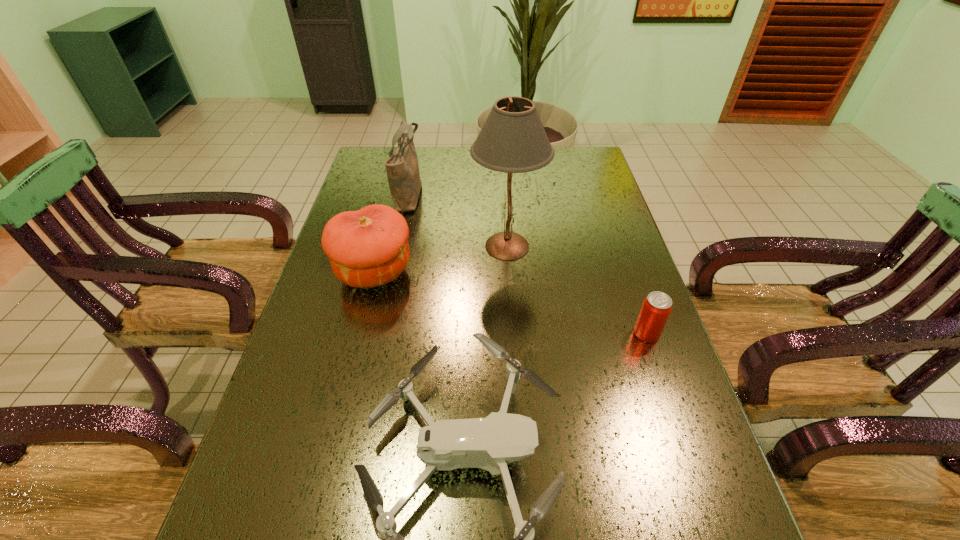
Identify the location of free space between the pumpkin and the tallest object. The image size is (960, 540). (441, 259).

The width and height of the screenshot is (960, 540). I want to click on free space between the can and the farthest object, so click(528, 264).

You are a GUI agent. You are given a task and a screenshot of the screen. Output one action in this format:
    pyautogui.click(x=<x>, y=<y>)
    Task: Click on the free space between the table lamp and the farthest object
    The width and height of the screenshot is (960, 540).
    Given the screenshot: What is the action you would take?
    tap(458, 220)

Locate an element on the screen. This screenshot has height=540, width=960. vacant region between the second nearest object and the fourth shortest object is located at coordinates (528, 264).

You are a GUI agent. You are given a task and a screenshot of the screen. Output one action in this format:
    pyautogui.click(x=<x>, y=<y>)
    Task: Click on the object that ranks as the fourth closest to the rightmost object
    Image resolution: width=960 pixels, height=540 pixels.
    Given the screenshot: What is the action you would take?
    pyautogui.click(x=402, y=168)

Where is `object that is the third nearest to the tallest object`? This screenshot has width=960, height=540. object that is the third nearest to the tallest object is located at coordinates [657, 306].

This screenshot has height=540, width=960. Find the location of `free space that satisfies the following two spatial constraints: 1. on the front-facing side of the fourth farthest object; 2. on the left side of the tallest object`. free space that satisfies the following two spatial constraints: 1. on the front-facing side of the fourth farthest object; 2. on the left side of the tallest object is located at coordinates (513, 333).

What are the coordinates of `free space that satisfies the following two spatial constraints: 1. on the front-facing side of the can; 2. on the left side of the tallest object` in the screenshot? It's located at (513, 333).

Identify the location of vacant area that satisfies the following two spatial constraints: 1. on the front-facing side of the second tallest object; 2. on the back side of the fourth farthest object. (380, 333).

Where is `vacant point that satisfies the following two spatial constraints: 1. on the front-facing side of the rightmost object; 2. on the left side of the fourth shortest object`? This screenshot has height=540, width=960. vacant point that satisfies the following two spatial constraints: 1. on the front-facing side of the rightmost object; 2. on the left side of the fourth shortest object is located at coordinates (380, 333).